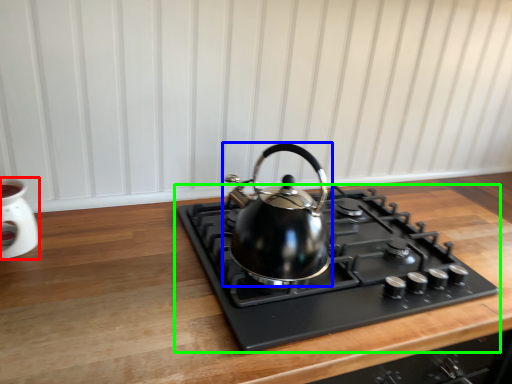
Question: Which object is positioned farthest from appliance (highlighted by a red box)? Select from kettle (highlighted by a blue box) and gas stove (highlighted by a green box).

Choices:
 (A) kettle
 (B) gas stove

Answer: (B)